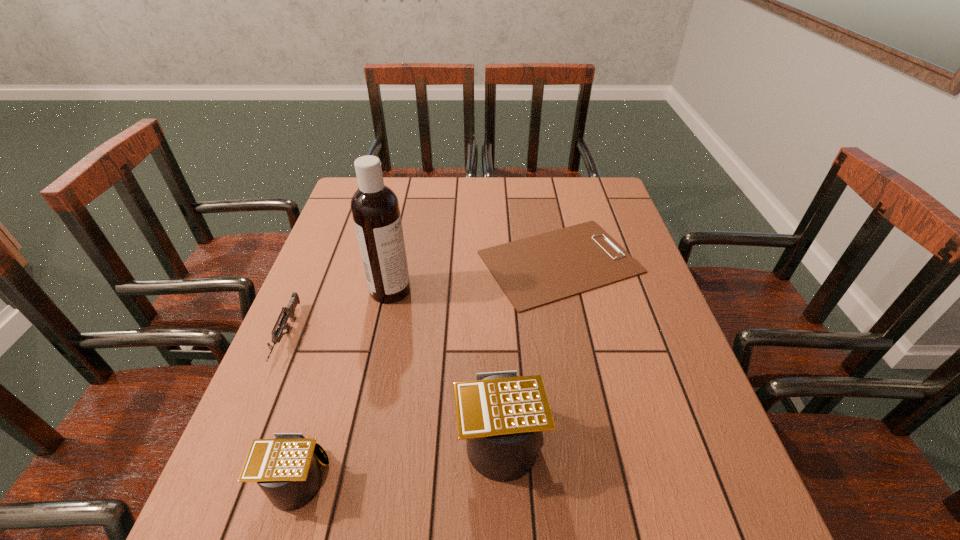
Image resolution: width=960 pixels, height=540 pixels. What are the coordinates of `vacant space located on the label side of the tallest object` in the screenshot? It's located at (521, 291).

At what (x,y) coordinates should I click in order to perform the action: click on vacant space located aimed along the barrel of the second shortest object. Please return your answer as a coordinate pair (x, y). This screenshot has width=960, height=540. Looking at the image, I should click on (258, 403).

At what (x,y) coordinates should I click in order to perform the action: click on free region located on the front of the shortest object. Please return your answer as a coordinate pair (x, y). This screenshot has width=960, height=540. Looking at the image, I should click on (604, 474).

Locate an element on the screen. Image resolution: width=960 pixels, height=540 pixels. calculator that is at the left edge is located at coordinates (285, 468).

Identify the location of gun that is at the left edge. (288, 312).

Identify the location of object situated at the right edge. The width and height of the screenshot is (960, 540). (538, 270).

The width and height of the screenshot is (960, 540). I want to click on object located at the near left corner, so click(285, 468).

Find the location of `free space at the far edge`. free space at the far edge is located at coordinates (402, 180).

Where is `blank space at the near edge`? This screenshot has width=960, height=540. blank space at the near edge is located at coordinates (632, 449).

Locate an element on the screen. The height and width of the screenshot is (540, 960). free point at the left edge is located at coordinates (319, 292).